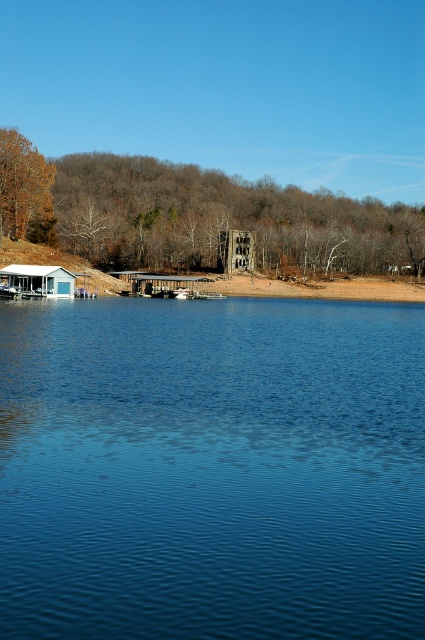
From the picture: You are standing on the lakeshore and want to reach the wooden cabin at center. Which direction should you walk to avoid the blue liquid water at center?

The blue liquid water at center is below the wooden cabin at center, so you should walk towards the cabin from above its position to avoid stepping into the water.

You are planning to set up a picnic area between the white wood cabin at lower left and the metallic gray dock at center. Given their widths, which structure should you place closer to the water to ensure the picnic area is wider?

The metallic gray dock at center is wider than the white wood cabin at lower left, so placing the picnic area closer to the water near the metallic gray dock at center would provide a wider space.

You are standing at the point marked by coordinates point (212, 468) in the image. Based on the scene described, what would you most likely see directly below your feet?

The point (212, 468) marks blue liquid water at center, so you would see blue liquid water directly below your feet.